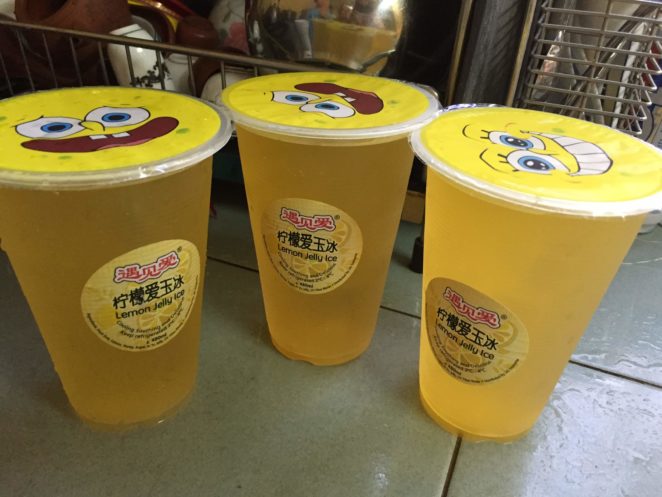
Image resolution: width=662 pixels, height=497 pixels. In order to click on wire basket in this screenshot , I will do `click(187, 51)`.